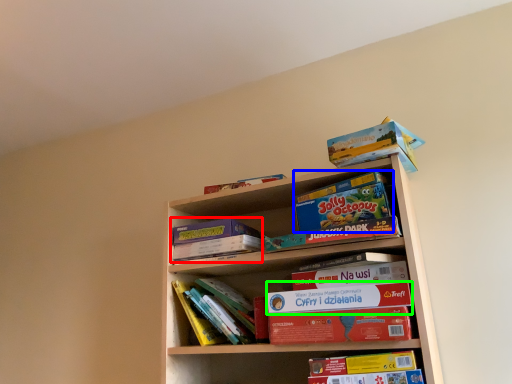
Question: Which is farther away from paperback book (highlighted by a red box)? paperback book (highlighted by a blue box) or paperback book (highlighted by a green box)?

Choices:
 (A) paperback book
 (B) paperback book

Answer: (A)